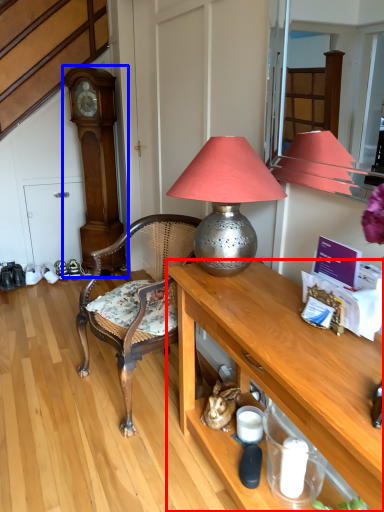
Question: Which object appears farthest to the camera in this image, desk (highlighted by a red box) or clock (highlighted by a blue box)?

Choices:
 (A) desk
 (B) clock

Answer: (B)